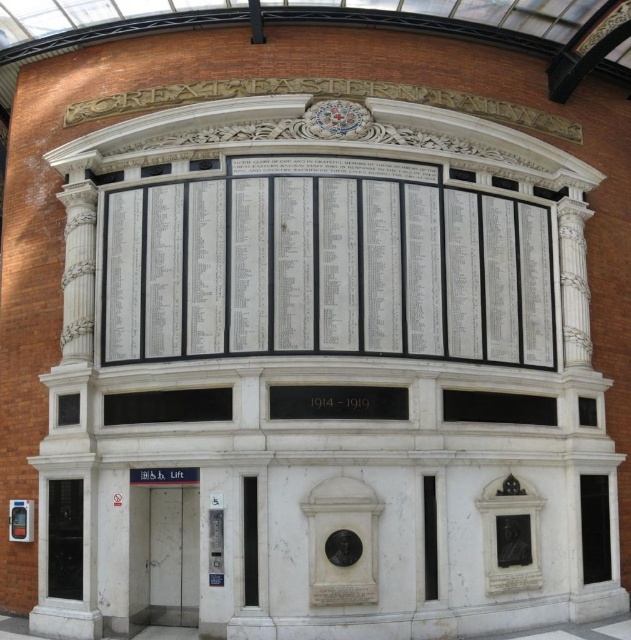
Is point (172, 326) less distant than point (601, 544)?

Yes, it is in front of point (601, 544).

Does white marble memorial at center have a smaller size compared to transparent glass window at lower right?

Incorrect, white marble memorial at center is not smaller in size than transparent glass window at lower right.

Is point (372, 202) positioned in front of point (586, 577)?

No, it is not.

The height and width of the screenshot is (640, 631). I want to click on white marble memorial at center, so click(x=326, y=266).

Does black glass window at center have a larger size compared to transparent glass window at lower right?

Incorrect, black glass window at center is not larger than transparent glass window at lower right.

Between black glass window at center and transparent glass window at lower right, which one appears on the right side from the viewer's perspective?

transparent glass window at lower right is more to the right.

Does point (442, 404) lie behind point (591, 550)?

No.

Where is `black glass window at center`? The width and height of the screenshot is (631, 640). black glass window at center is located at coordinates (498, 406).

Does white marble memorial at center have a greater width compared to black marble plaque at center?

Yes, white marble memorial at center is wider than black marble plaque at center.

Is white marble memorial at center behind black marble plaque at center?

Yes, white marble memorial at center is further from the viewer.

Which is behind, point (514, 356) or point (369, 412)?

The point (514, 356) is behind.

This screenshot has height=640, width=631. What are the coordinates of `white marble memorial at center` in the screenshot? It's located at (326, 266).